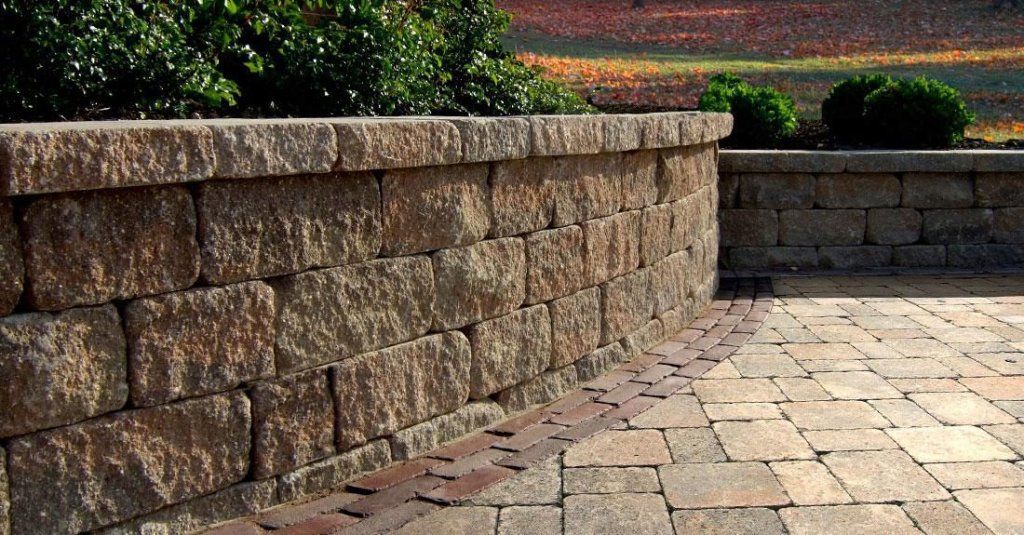
Locate an element on the screen. The image size is (1024, 535). empty space on top of brick wall is located at coordinates (440, 112).